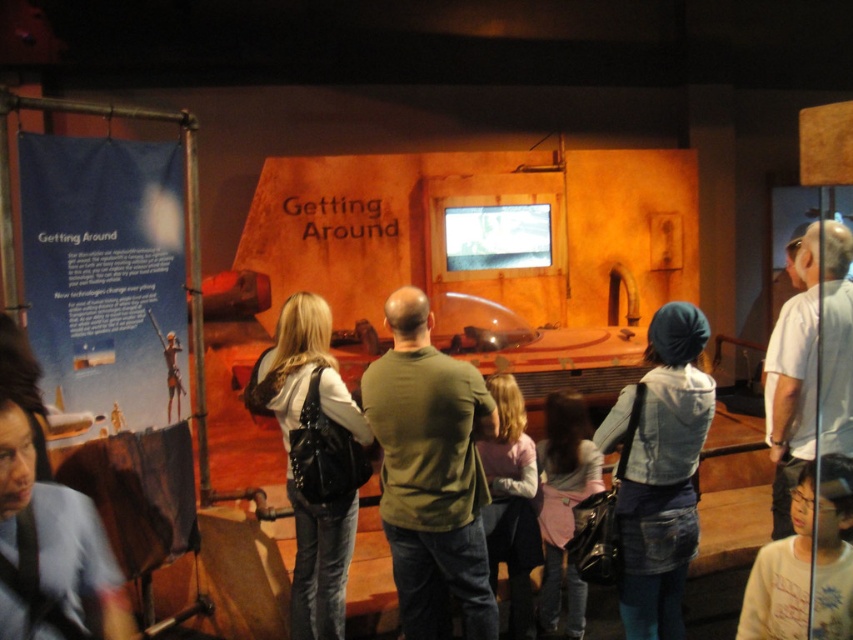
Can you confirm if white leather jacket at center is positioned below blue shirt at lower left?

Yes, white leather jacket at center is below blue shirt at lower left.

Between white leather jacket at center and blue shirt at lower left, which one is positioned lower?

white leather jacket at center is lower down.

Who is more distant from viewer, (283,435) or (3,620)?

The point (283,435) is more distant.

Where is `white leather jacket at center`? The width and height of the screenshot is (853, 640). white leather jacket at center is located at coordinates (314, 458).

Is denim jacket at lower right below pink fabric at center?

Incorrect, denim jacket at lower right is not positioned below pink fabric at center.

Who is shorter, denim jacket at lower right or pink fabric at center?

With less height is pink fabric at center.

Where is `denim jacket at lower right`? The width and height of the screenshot is (853, 640). denim jacket at lower right is located at coordinates (660, 472).

You are a GUI agent. You are given a task and a screenshot of the screen. Output one action in this format:
    pyautogui.click(x=<x>, y=<y>)
    Task: Click on the denim jacket at lower right
    Image resolution: width=853 pixels, height=640 pixels.
    Given the screenshot: What is the action you would take?
    pyautogui.click(x=660, y=472)

Is gray fabric shirt at upper right smaller than blue shirt at lower left?

Incorrect, gray fabric shirt at upper right is not smaller in size than blue shirt at lower left.

Consider the image. Is gray fabric shirt at upper right thinner than blue shirt at lower left?

Incorrect, gray fabric shirt at upper right's width is not less than blue shirt at lower left's.

Who is more distant from viewer, (846, 385) or (9, 428)?

The point (846, 385) is more distant.

Locate an element on the screen. Image resolution: width=853 pixels, height=640 pixels. gray fabric shirt at upper right is located at coordinates (809, 365).